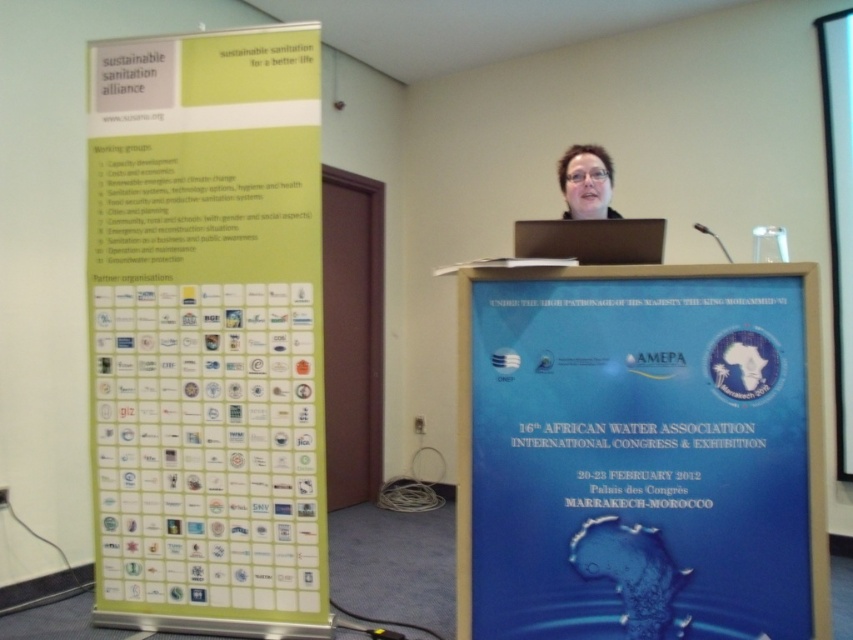
Can you confirm if green paper poster at left is positioned to the right of blue glossy poster at center?

In fact, green paper poster at left is to the left of blue glossy poster at center.

Does green paper poster at left have a greater width compared to blue glossy poster at center?

Incorrect, green paper poster at left's width does not surpass blue glossy poster at center's.

Is point (224, 509) positioned behind point (537, 420)?

Yes.

Find the location of a particular element. The width and height of the screenshot is (853, 640). green paper poster at left is located at coordinates (207, 332).

The image size is (853, 640). Describe the element at coordinates (207, 332) in the screenshot. I see `green paper poster at left` at that location.

In the scene shown: Is green paper poster at left positioned at the back of matte black screen at center?

Yes.

Does point (289, 426) come farther from viewer compared to point (532, 252)?

That is True.

Locate an element on the screen. green paper poster at left is located at coordinates tap(207, 332).

Between point (585, 260) and point (589, 198), which one is positioned behind?

The point (589, 198) is behind.

Is point (549, 241) more distant than point (579, 173)?

No.

The image size is (853, 640). Identify the location of matte black screen at center. (590, 240).